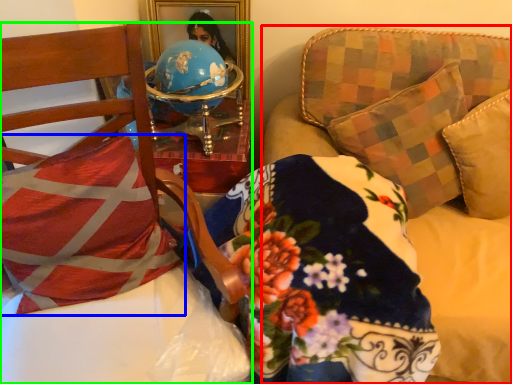
Question: Based on their relative distances, which object is nearer to studio couch (highlighted by a red box)? Choose from pillow (highlighted by a blue box) and furniture (highlighted by a green box).

Choices:
 (A) pillow
 (B) furniture

Answer: (B)